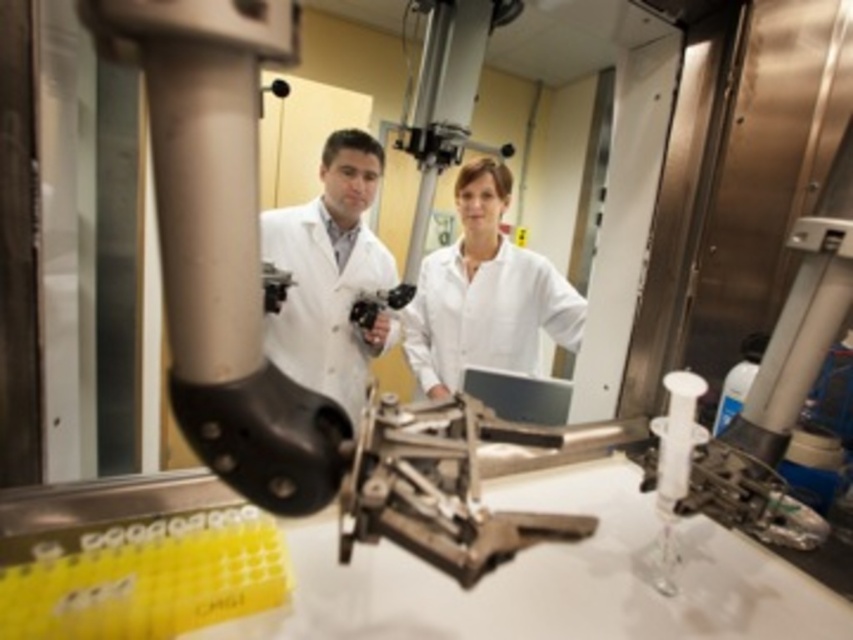
Between point (373, 234) and point (491, 342), which one is positioned in front?

Positioned in front is point (491, 342).

The height and width of the screenshot is (640, 853). What are the coordinates of `white lab coat at center` in the screenshot? It's located at (329, 275).